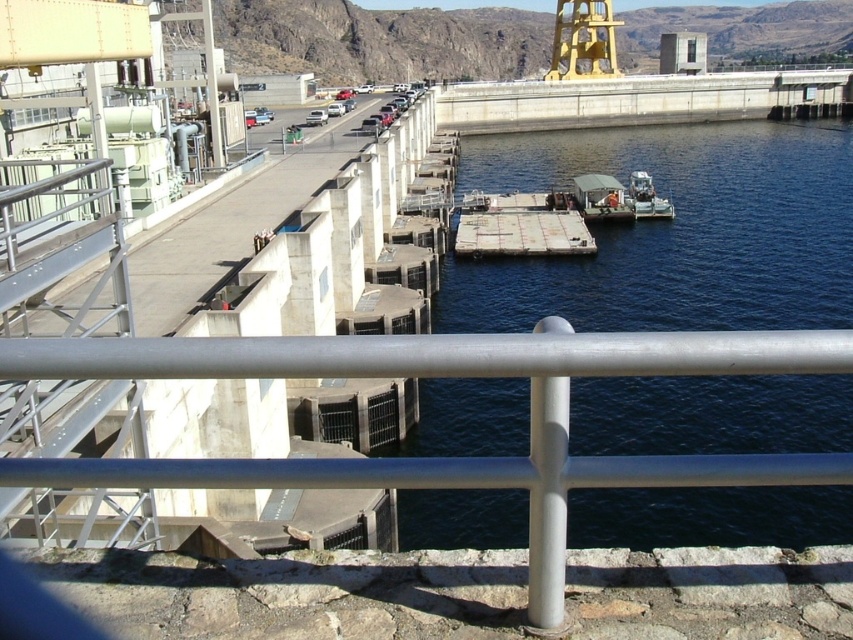
Question: Does blue water at center appear on the left side of white matte boat at center?

Choices:
 (A) no
 (B) yes

Answer: (A)

Question: Is white matte boat at center bigger than white plastic boat at center?

Choices:
 (A) no
 (B) yes

Answer: (A)

Question: Which object is positioned closest to the white matte boat at center?

Choices:
 (A) blue water at center
 (B) white plastic boat at center

Answer: (B)

Question: Among these objects, which one is farthest from the camera?

Choices:
 (A) white matte boat at center
 (B) blue water at center
 (C) white plastic boat at center

Answer: (C)

Question: Can you confirm if blue water at center is bigger than white plastic boat at center?

Choices:
 (A) no
 (B) yes

Answer: (B)

Question: Which of the following is the farthest from the observer?

Choices:
 (A) white matte boat at center
 (B) white plastic boat at center
 (C) blue water at center

Answer: (B)